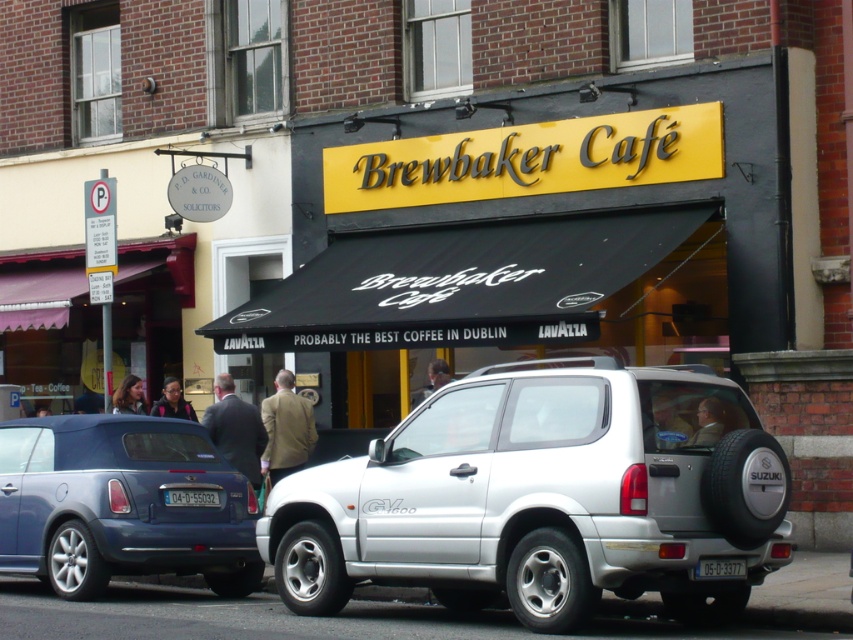
Which is above, tan leather jacket at center or dark brown leather jacket at center?

dark brown leather jacket at center is higher up.

Who is taller, tan leather jacket at center or dark brown leather jacket at center?

Standing taller between the two is tan leather jacket at center.

At what (x,y) coordinates should I click in order to perform the action: click on tan leather jacket at center. Please return your answer as a coordinate pair (x, y). The height and width of the screenshot is (640, 853). Looking at the image, I should click on (286, 428).

Does dark suit at center have a greater height compared to dark brown leather jacket at center?

Yes, dark suit at center is taller than dark brown leather jacket at center.

Between dark suit at center and dark brown leather jacket at center, which one has less height?

dark brown leather jacket at center is shorter.

The height and width of the screenshot is (640, 853). What do you see at coordinates (235, 429) in the screenshot?
I see `dark suit at center` at bounding box center [235, 429].

This screenshot has height=640, width=853. Identify the location of dark suit at center. (235, 429).

Image resolution: width=853 pixels, height=640 pixels. Describe the element at coordinates (120, 504) in the screenshot. I see `metallic blue convertible at lower left` at that location.

Can you confirm if metallic blue convertible at lower left is shorter than white plastic license plate at center?

No, metallic blue convertible at lower left is not shorter than white plastic license plate at center.

Which is behind, point (4, 492) or point (212, 506)?

The point (4, 492) is more distant.

This screenshot has width=853, height=640. I want to click on metallic blue convertible at lower left, so click(x=120, y=504).